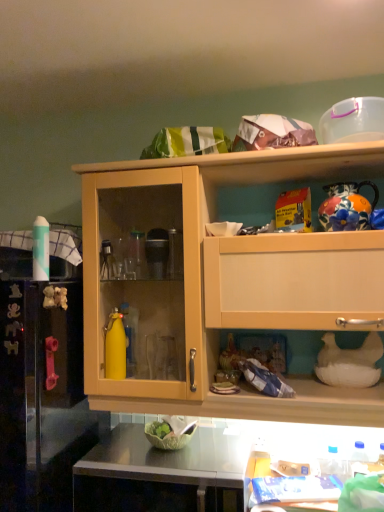
This screenshot has width=384, height=512. Describe the element at coordinates (169, 458) in the screenshot. I see `metallic stainless steel counter top at lower center` at that location.

The image size is (384, 512). I want to click on white glossy table at lower center, so click(x=288, y=482).

From the image's perspective, is light wood cabinet at upper center on top of metallic stainless steel counter top at lower center?

Yes, from the image's perspective, light wood cabinet at upper center is over metallic stainless steel counter top at lower center.

How different are the orientations of light wood cabinet at upper center and metallic stainless steel counter top at lower center in degrees?

light wood cabinet at upper center and metallic stainless steel counter top at lower center are facing 0.992 degrees away from each other.

Does light wood cabinet at upper center have a greater width compared to metallic stainless steel counter top at lower center?

No, light wood cabinet at upper center is not wider than metallic stainless steel counter top at lower center.

Considering the relative sizes of yellow rubber glove at left and white glossy table at lower center in the image provided, is yellow rubber glove at left wider than white glossy table at lower center?

Correct, the width of yellow rubber glove at left exceeds that of white glossy table at lower center.

Could you tell me if yellow rubber glove at left is turned towards white glossy table at lower center?

No, yellow rubber glove at left does not turn towards white glossy table at lower center.

Is yellow rubber glove at left inside the boundaries of white glossy table at lower center, or outside?

yellow rubber glove at left is outside white glossy table at lower center.

Is yellow rubber glove at left far from white glossy table at lower center?

No, yellow rubber glove at left is not far from white glossy table at lower center.

Does white glossy table at lower center appear on the right side of light wood cabinet at upper center?

Yes, white glossy table at lower center is to the right of light wood cabinet at upper center.

Looking at this image, is white glossy table at lower center oriented away from light wood cabinet at upper center?

white glossy table at lower center is not turned away from light wood cabinet at upper center.

From the image's perspective, which object appears higher, white glossy table at lower center or light wood cabinet at upper center?

light wood cabinet at upper center.

Considering the relative sizes of white glossy table at lower center and light wood cabinet at upper center in the image provided, is white glossy table at lower center shorter than light wood cabinet at upper center?

Indeed, white glossy table at lower center has a lesser height compared to light wood cabinet at upper center.

Do you think white glossy table at lower center is within yellow rubber glove at left, or outside of it?

white glossy table at lower center is not inside yellow rubber glove at left, it's outside.

Between white glossy table at lower center and yellow rubber glove at left, which one is positioned in front?

yellow rubber glove at left is more forward.

From the image's perspective, is white glossy table at lower center located above or below yellow rubber glove at left?

Clearly, from the image's perspective, white glossy table at lower center is below yellow rubber glove at left.

Who is shorter, white glossy table at lower center or yellow rubber glove at left?

white glossy table at lower center.

From the image's perspective, which one is positioned higher, light wood cabinet at upper center or yellow rubber glove at left?

light wood cabinet at upper center appears higher in the image.

From a real-world perspective, is light wood cabinet at upper center physically below yellow rubber glove at left?

No, from a real-world perspective, light wood cabinet at upper center is not below yellow rubber glove at left.

What are the coordinates of `cabinetry above the yellow rubber glove at left (from the image's perspective)` in the screenshot? It's located at (229, 282).

Is light wood cabinet at upper center behind yellow rubber glove at left?

Yes, the depth of light wood cabinet at upper center is greater than that of yellow rubber glove at left.

Who is more distant, metallic stainless steel counter top at lower center or yellow rubber glove at left?

Positioned behind is metallic stainless steel counter top at lower center.

What's the angular difference between metallic stainless steel counter top at lower center and yellow rubber glove at left's facing directions?

The angular difference between metallic stainless steel counter top at lower center and yellow rubber glove at left is 0.992 degrees.

Considering the relative positions of metallic stainless steel counter top at lower center and yellow rubber glove at left in the image provided, is metallic stainless steel counter top at lower center to the left or to the right of yellow rubber glove at left?

metallic stainless steel counter top at lower center is to the right of yellow rubber glove at left.

Is metallic stainless steel counter top at lower center surrounding yellow rubber glove at left?

That's incorrect, yellow rubber glove at left is not inside metallic stainless steel counter top at lower center.

Is yellow rubber glove at left positioned with its back to metallic stainless steel counter top at lower center?

No, yellow rubber glove at left's orientation is not away from metallic stainless steel counter top at lower center.

Which is correct: yellow rubber glove at left is inside metallic stainless steel counter top at lower center, or outside of it?

yellow rubber glove at left is outside metallic stainless steel counter top at lower center.

How many degrees apart are the facing directions of yellow rubber glove at left and metallic stainless steel counter top at lower center?

yellow rubber glove at left and metallic stainless steel counter top at lower center are facing 0.992 degrees away from each other.

Where is `appliance lying above the metallic stainless steel counter top at lower center (from the image's perspective)`? This screenshot has width=384, height=512. appliance lying above the metallic stainless steel counter top at lower center (from the image's perspective) is located at coordinates (41, 397).

Locate an element on the screen. counter top in front of the light wood cabinet at upper center is located at coordinates (169, 458).

At what (x,y) coordinates should I click in order to perform the action: click on appliance above the white glossy table at lower center (from a real-world perspective). Please return your answer as a coordinate pair (x, y). The height and width of the screenshot is (512, 384). Looking at the image, I should click on (41, 397).

When comparing their distances from yellow rubber glove at left, does white glossy table at lower center or metallic stainless steel counter top at lower center seem closer?

The object closer to yellow rubber glove at left is metallic stainless steel counter top at lower center.

Considering their positions, is metallic stainless steel counter top at lower center positioned further to yellow rubber glove at left than white glossy table at lower center?

Among the two, white glossy table at lower center is located further to yellow rubber glove at left.

Based on their spatial positions, is yellow rubber glove at left or metallic stainless steel counter top at lower center closer to light wood cabinet at upper center?

yellow rubber glove at left lies closer to light wood cabinet at upper center than the other object.

Looking at this image, which object lies further to the anchor point light wood cabinet at upper center, yellow rubber glove at left or white glossy table at lower center?

white glossy table at lower center is further to light wood cabinet at upper center.

Estimate the real-world distances between objects in this image. Which object is closer to metallic stainless steel counter top at lower center, light wood cabinet at upper center or white glossy table at lower center?

white glossy table at lower center lies closer to metallic stainless steel counter top at lower center than the other object.

Considering their positions, is metallic stainless steel counter top at lower center positioned closer to yellow rubber glove at left than light wood cabinet at upper center?

metallic stainless steel counter top at lower center lies closer to yellow rubber glove at left than the other object.

Looking at the image, which one is located closer to yellow rubber glove at left, light wood cabinet at upper center or white glossy table at lower center?

light wood cabinet at upper center is closer to yellow rubber glove at left.

Which object lies nearer to the anchor point light wood cabinet at upper center, metallic stainless steel counter top at lower center or yellow rubber glove at left?

yellow rubber glove at left is closer to light wood cabinet at upper center.

What are the coordinates of `table between light wood cabinet at upper center and metallic stainless steel counter top at lower center in the vertical direction` in the screenshot? It's located at (x=288, y=482).

I want to click on cabinetry between yellow rubber glove at left and white glossy table at lower center, so click(x=229, y=282).

Find the location of a particular element. counter top located between yellow rubber glove at left and light wood cabinet at upper center in the left-right direction is located at coordinates coord(169,458).

This screenshot has width=384, height=512. Find the location of `counter top between yellow rubber glove at left and white glossy table at lower center`. counter top between yellow rubber glove at left and white glossy table at lower center is located at coordinates (169, 458).